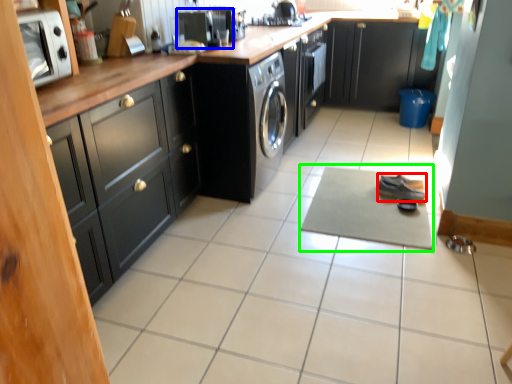
Question: Which object is positioned closest to shoe (highlighted by a red box)? Select from appliance (highlighted by a blue box) and yoga mat (highlighted by a green box).

Choices:
 (A) appliance
 (B) yoga mat

Answer: (B)